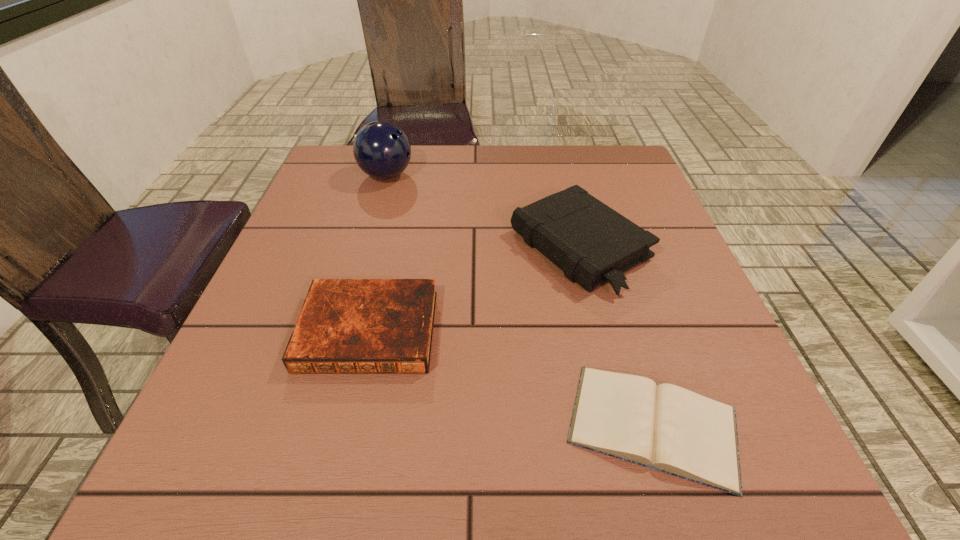
Locate an element on the screen. vacant area in the image that satisfies the following two spatial constraints: 1. on the spine side of the second tallest Bible; 2. on the left side of the shortest object is located at coordinates (347, 425).

I want to click on vacant space that satisfies the following two spatial constraints: 1. on the surface of the farthest object near the finger holes; 2. on the right side of the third shortest object, so click(366, 247).

At what (x,y) coordinates should I click in order to perform the action: click on free spot that satisfies the following two spatial constraints: 1. on the surface of the bowling ball near the finger holes; 2. on the right side of the second tallest object. Please return your answer as a coordinate pair (x, y). This screenshot has width=960, height=540. Looking at the image, I should click on (366, 247).

Locate an element on the screen. Image resolution: width=960 pixels, height=540 pixels. vacant space that satisfies the following two spatial constraints: 1. on the spine side of the shortest object; 2. on the right side of the leftmost Bible is located at coordinates (347, 425).

Find the location of a particular element. vacant space that satisfies the following two spatial constraints: 1. on the surface of the tallest Bible near the finger holes; 2. on the left side of the tallest object is located at coordinates (366, 247).